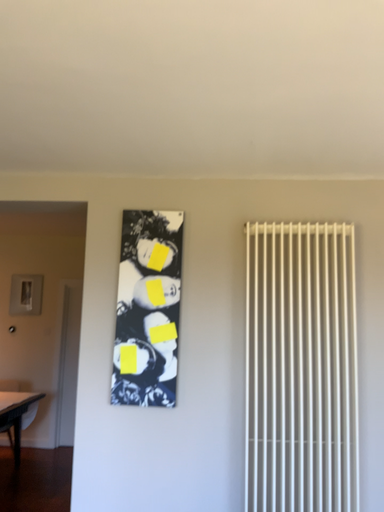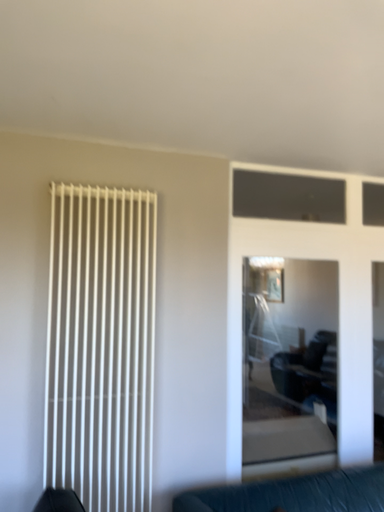
Question: Which way did the camera rotate in the video?

Choices:
 (A) rotated right
 (B) rotated left

Answer: (A)